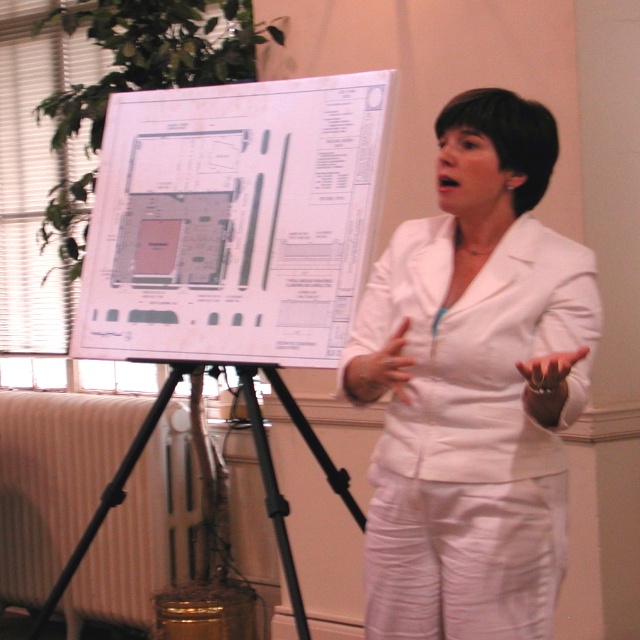
Which is in front, point (385, 296) or point (275, 378)?

Positioned in front is point (385, 296).

Is point (538, 292) farther from viewer compared to point (140, 438)?

No, it is in front of (140, 438).

Where is `white matte blazer at center`? This screenshot has width=640, height=640. white matte blazer at center is located at coordinates (474, 387).

Is white matte blazer at center in front of white paper at center?

Yes, white matte blazer at center is closer to the viewer.

Does white matte blazer at center appear on the left side of white paper at center?

A: No, white matte blazer at center is not to the left of white paper at center.

Which is behind, point (524, 424) or point (301, 332)?

The point (301, 332) is more distant.

Identify the location of white matte blazer at center. The image size is (640, 640). (474, 387).

Can you confirm if white paper at center is smaller than black matte tripod at center?

Correct, white paper at center occupies less space than black matte tripod at center.

Find the location of a particular element. This screenshot has height=640, width=640. white paper at center is located at coordinates (232, 221).

Identify the location of white paper at center. click(232, 221).